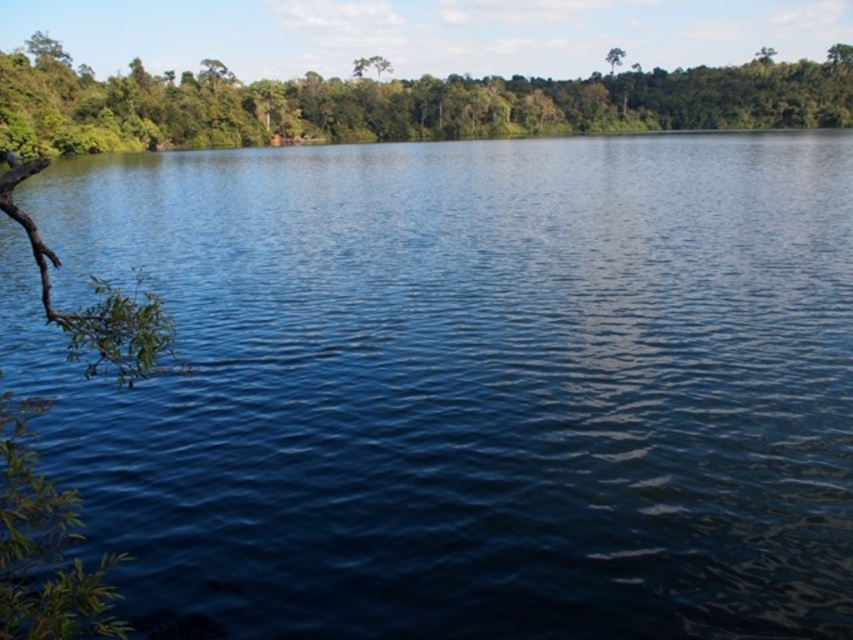
You are a bird looking for a nesting spot. You see the green leafy tree at upper left and the green leafy tree at upper center. Which tree has a wider canopy for nesting?

The green leafy tree at upper left has a wider canopy than the green leafy tree at upper center, so it is better for nesting.

You are a bird looking for a nesting spot. You see the green leafy tree at upper left and the green leafy tree at upper center. Which tree would you choose if you want a larger tree to build your nest?

The green leafy tree at upper left is bigger than the green leafy tree at upper center, so you should choose the green leafy tree at upper left to build your nest.